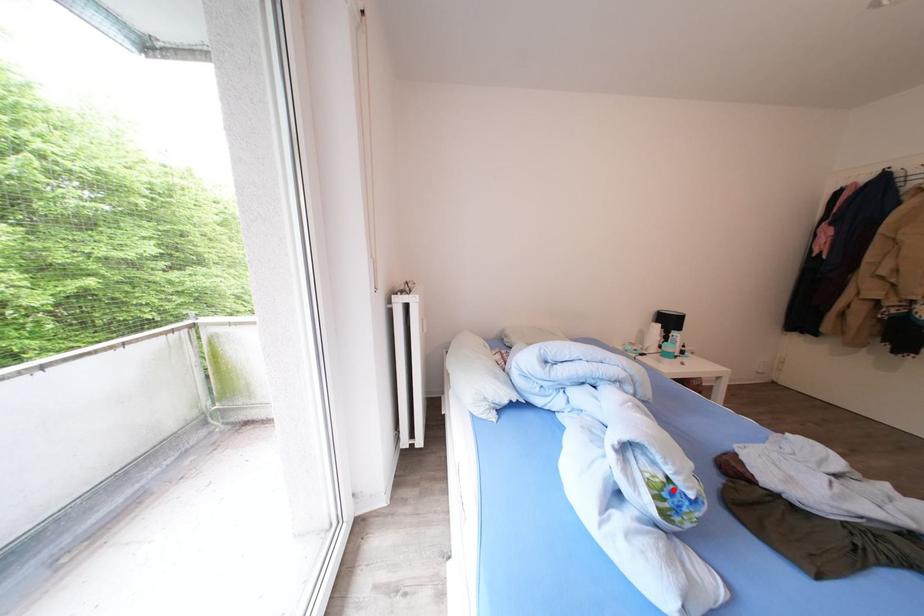
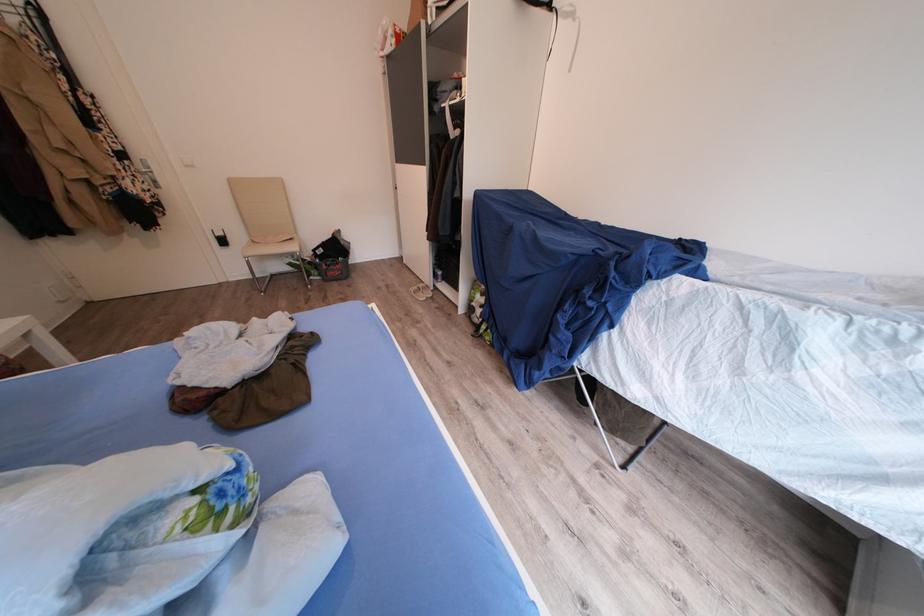
In the second image, find the point that corresponds to the highlighted location in the first image.

(213, 507)